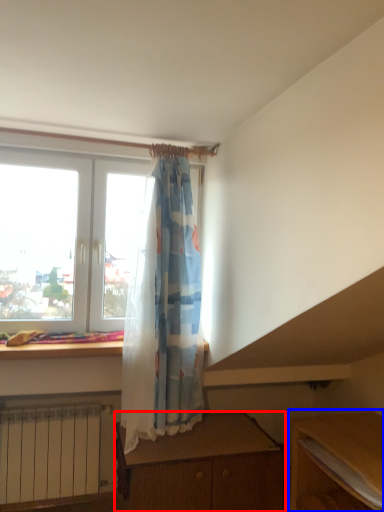
Question: Which object is closer to the camera taking this photo, desk (highlighted by a red box) or table (highlighted by a blue box)?

Choices:
 (A) desk
 (B) table

Answer: (B)